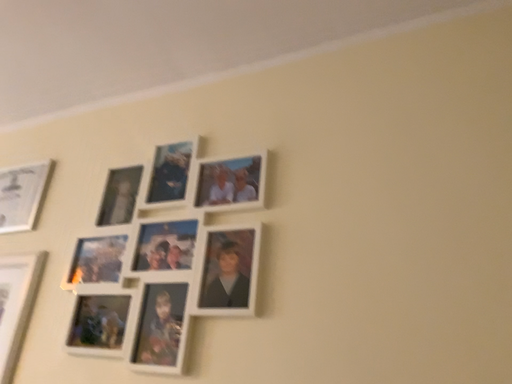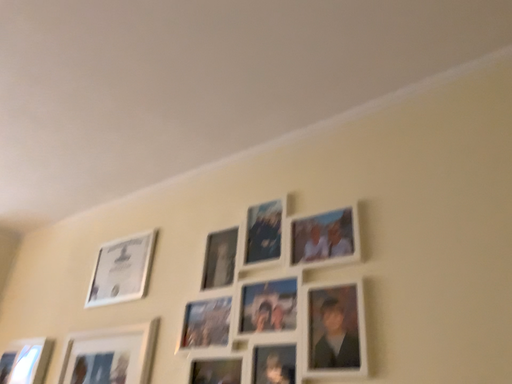
Question: How did the camera likely rotate when shooting the video?

Choices:
 (A) rotated left
 (B) rotated right

Answer: (A)